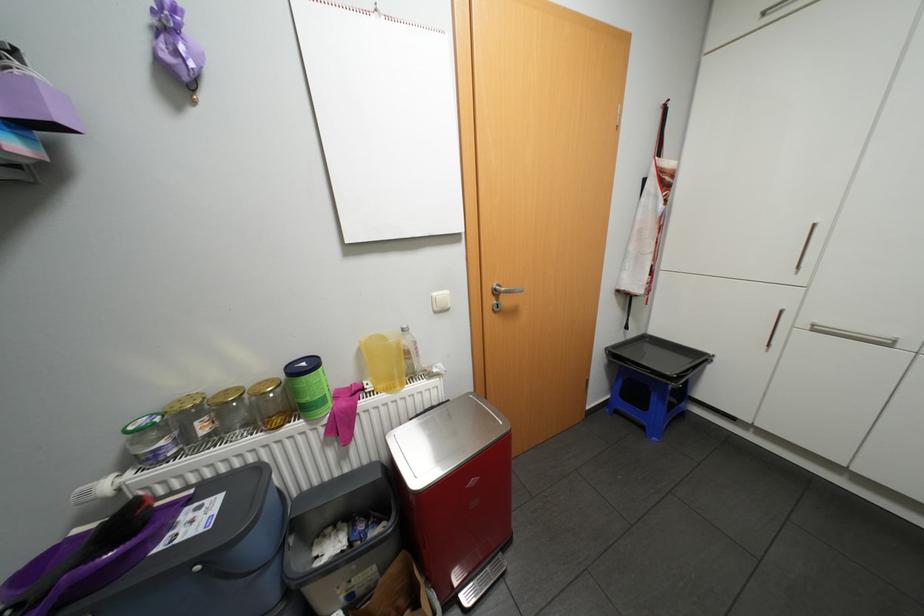
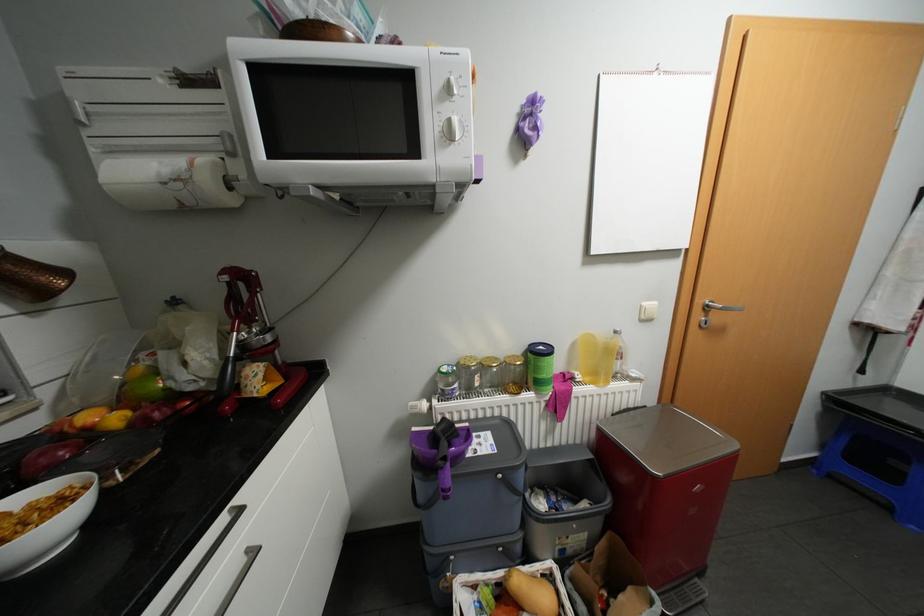
In the second image, find the point that corresponds to (x=504, y=289) in the first image.

(715, 305)